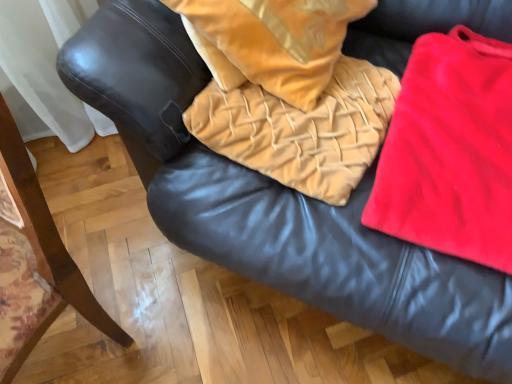
I want to click on vacant area that is situated to the right of matte black armrest at left, so click(193, 334).